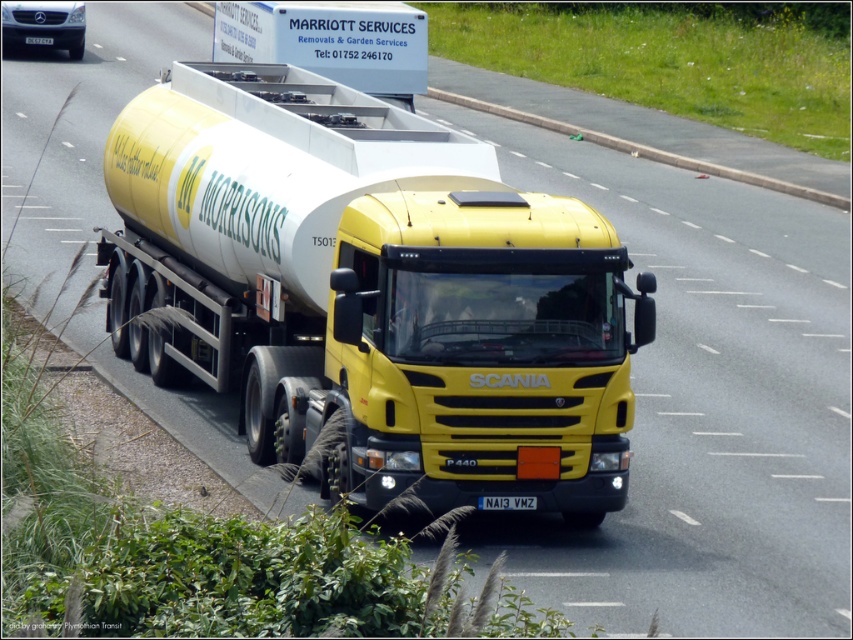
Can you confirm if yellow matte trailer truck at center is taller than white plastic license plate at center?

Indeed, yellow matte trailer truck at center has a greater height compared to white plastic license plate at center.

This screenshot has width=853, height=640. What are the coordinates of `yellow matte trailer truck at center` in the screenshot? It's located at (370, 292).

The width and height of the screenshot is (853, 640). What do you see at coordinates (370, 292) in the screenshot?
I see `yellow matte trailer truck at center` at bounding box center [370, 292].

The image size is (853, 640). What are the coordinates of `yellow matte trailer truck at center` in the screenshot? It's located at (370, 292).